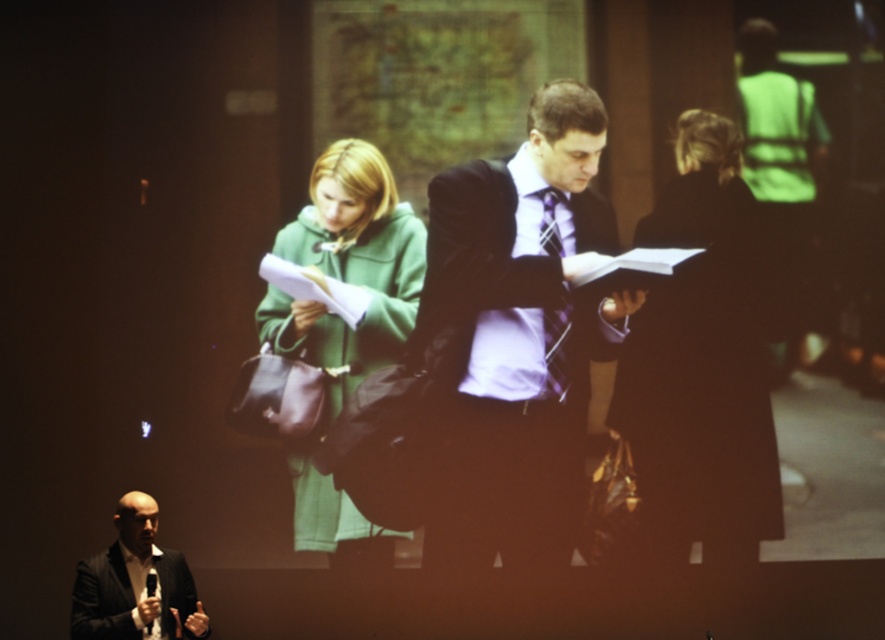
Question: Which point appears farthest from the camera in this image?

Choices:
 (A) [553, 381]
 (B) [630, 449]
 (C) [294, 252]
 (D) [94, 576]

Answer: (A)

Question: Where is green matte coat at center located in relation to purple silk tie at center in the image?

Choices:
 (A) above
 (B) below

Answer: (B)

Question: Can you confirm if green matte coat at center is wider than purple silk tie at center?

Choices:
 (A) yes
 (B) no

Answer: (A)

Question: Is the position of matte black coat at center less distant than that of matte black suit at lower left?

Choices:
 (A) no
 (B) yes

Answer: (A)

Question: Which is nearer to the matte black coat at center?

Choices:
 (A) matte black suit at center
 (B) green matte coat at center

Answer: (A)

Question: Which object appears farthest from the camera in this image?

Choices:
 (A) green matte coat at center
 (B) purple silk tie at center

Answer: (B)